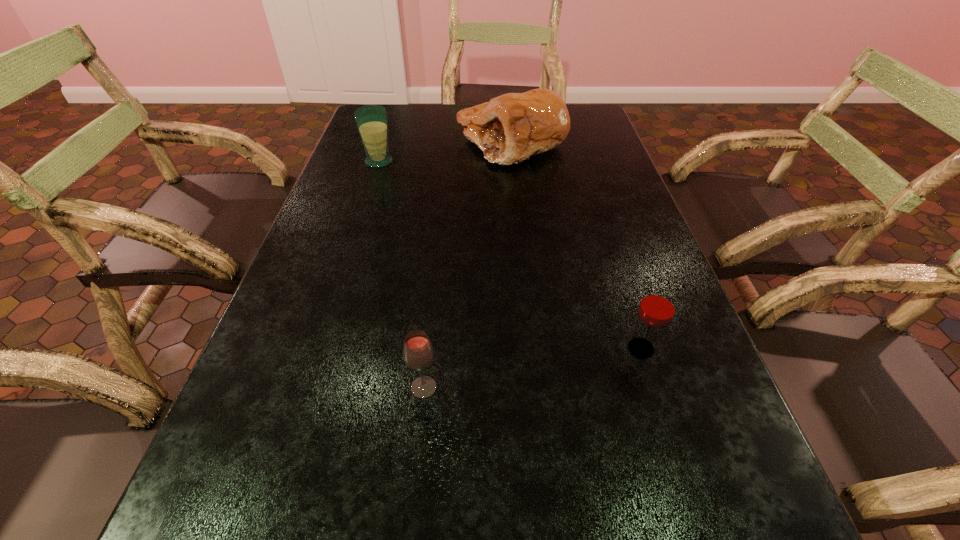
Locate an element on the screen. bread is located at coordinates (510, 128).

This screenshot has height=540, width=960. I want to click on the leftmost glass drink container, so click(372, 120).

I want to click on the leftmost object, so pos(372,120).

The width and height of the screenshot is (960, 540). In order to click on the second farthest glass drink container in this screenshot , I will do `click(657, 307)`.

The image size is (960, 540). I want to click on the second nearest object, so click(657, 307).

Find the location of a particular element. the nearest object is located at coordinates (418, 353).

This screenshot has height=540, width=960. I want to click on the second glass drink container from left to right, so click(x=418, y=353).

Image resolution: width=960 pixels, height=540 pixels. Identify the location of free space located 0.220m on the filling side of the bread. (385, 143).

The image size is (960, 540). In order to click on vacant space located 0.290m on the filling side of the bread in this screenshot , I will do `click(363, 143)`.

Identify the location of free space located on the filling side of the bread. This screenshot has width=960, height=540. (372, 143).